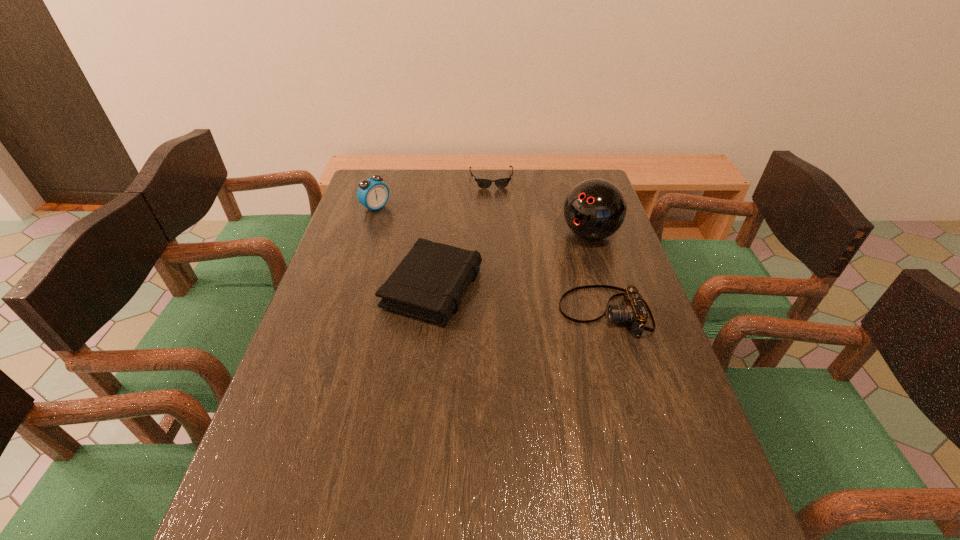
The width and height of the screenshot is (960, 540). In order to click on Bible in this screenshot , I will do (428, 284).

The width and height of the screenshot is (960, 540). Identify the location of camera. (634, 311).

Find the location of a particular element. The height and width of the screenshot is (540, 960). the third farthest object is located at coordinates (594, 209).

Where is `the tallest object`? the tallest object is located at coordinates (594, 209).

At what (x,y) coordinates should I click in order to perform the action: click on the shortest object. Please return your answer as a coordinate pair (x, y). Image resolution: width=960 pixels, height=540 pixels. Looking at the image, I should click on (482, 183).

Locate an element on the screen. The width and height of the screenshot is (960, 540). sunglasses is located at coordinates (482, 183).

Where is `the leftmost object`? The image size is (960, 540). the leftmost object is located at coordinates (372, 193).

Identify the location of alarm clock. This screenshot has width=960, height=540. (372, 193).

Where is `blank area located 0.210m on the back of the Bible`? Image resolution: width=960 pixels, height=540 pixels. blank area located 0.210m on the back of the Bible is located at coordinates (442, 215).

Identify the location of vacant region located on the front-facing side of the camera. (537, 312).